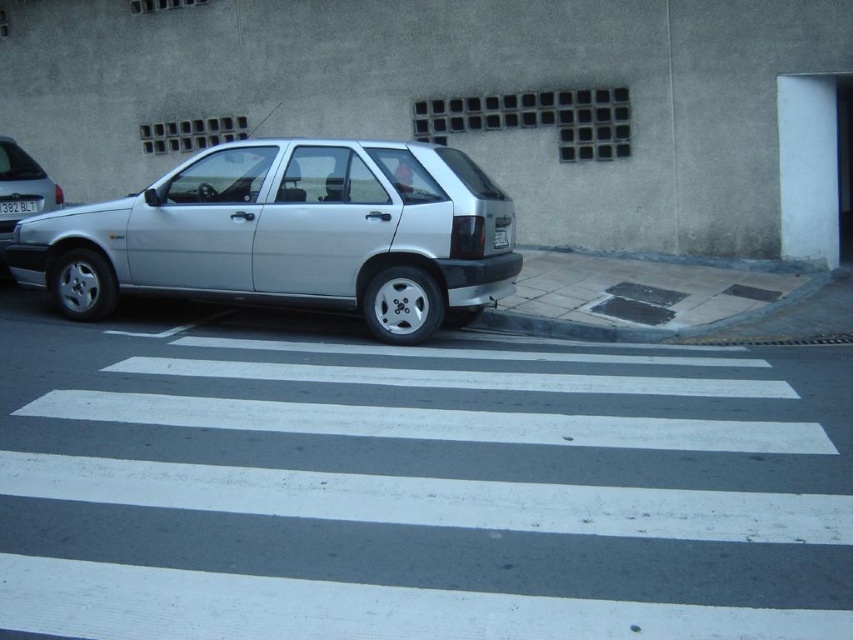
You are standing at the curb and want to cross the street to the building behind the car. The car is at point (289, 234). Where should you look for the pedestrian crossing relative to the car?

The pedestrian crossing is located to the left of the satin silver car at center since the car is parked near the pedestrian crossing on the right side.